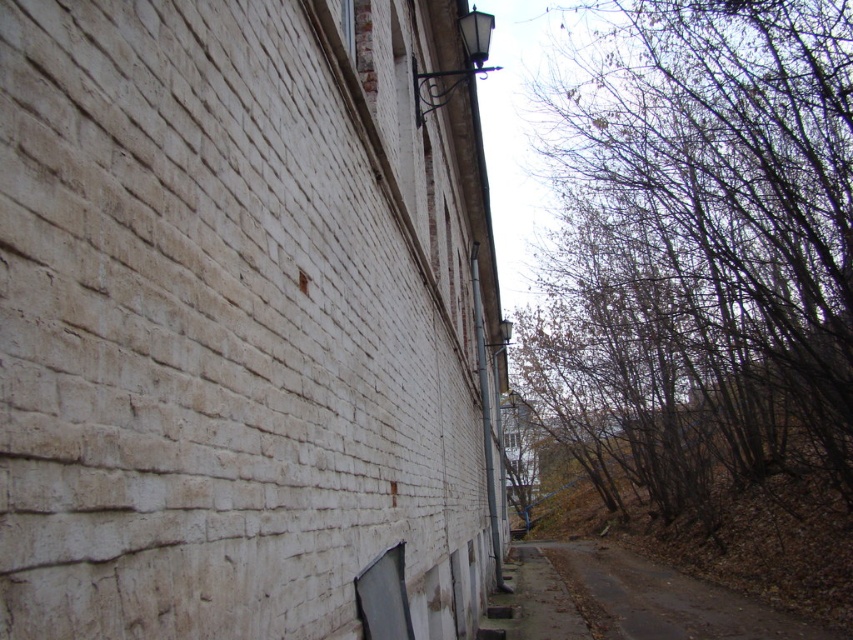
You are a delivery person with a cart that is 2 meters wide. You need to navigate through the space between the brown leafless trees at upper right and the brown dirt road at lower right. Can your cart fit through the gap between them?

The gap between the brown leafless trees at upper right and the brown dirt road at lower right is 7.40 meters. Since your cart is only 2 meters wide, it can easily fit through the gap between them.

You are standing on the brown dirt road at lower right and want to walk towards the brown leafless trees at upper right. Which direction should you head?

You should head to the left because the brown leafless trees at upper right are to the right of the brown dirt road at lower right, so moving left from the road will lead you toward them.

You are a delivery person trying to navigate through the area. You see the brown leafless trees at upper right and the brown dirt road at lower right. Which of these two has a greater width?

The brown leafless trees at upper right has a greater width than the brown dirt road at lower right.